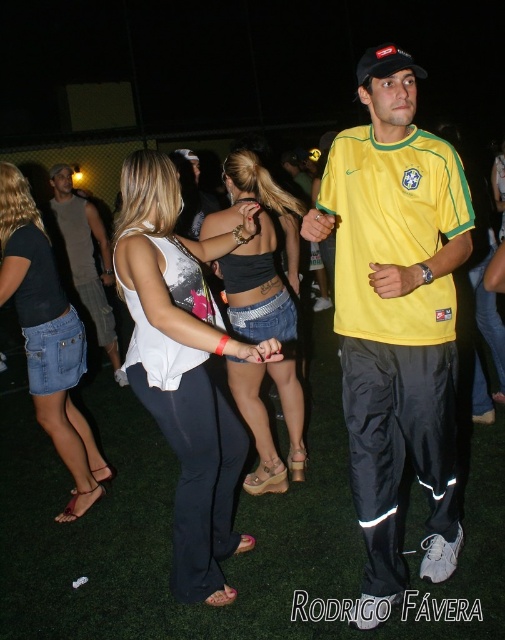
Question: Which point is farther to the camera?

Choices:
 (A) yellow fabric shirt at center
 (B) denim skirt at center
 (C) denim skirt at lower left

Answer: (C)

Question: Which object is the farthest from the white fabric top at center?

Choices:
 (A) denim skirt at center
 (B) denim shorts at left
 (C) denim skirt at lower left
 (D) yellow fabric shirt at center

Answer: (B)

Question: Is yellow fabric shirt at center positioned in front of white fabric top at center?

Choices:
 (A) no
 (B) yes

Answer: (B)

Question: Can you confirm if yellow fabric shirt at center is thinner than denim skirt at lower left?

Choices:
 (A) yes
 (B) no

Answer: (B)

Question: Which point is closer to the camera taking this photo?

Choices:
 (A) (466, 212)
 (B) (111, 317)

Answer: (A)

Question: Can you confirm if yellow fabric shirt at center is positioned to the right of white fabric top at center?

Choices:
 (A) no
 (B) yes

Answer: (B)